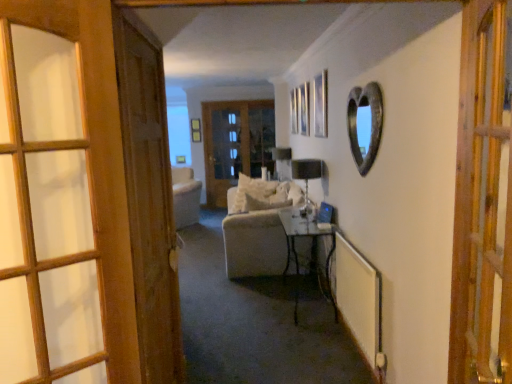
Where is `empty space that is ontop of rustic metal heart-shaped mirror at upper right`? empty space that is ontop of rustic metal heart-shaped mirror at upper right is located at coordinates (364, 79).